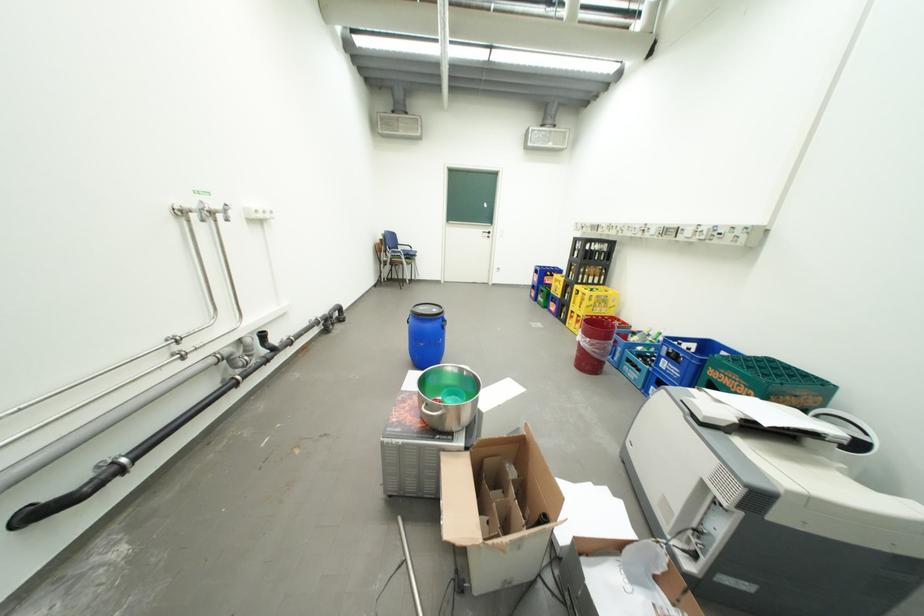
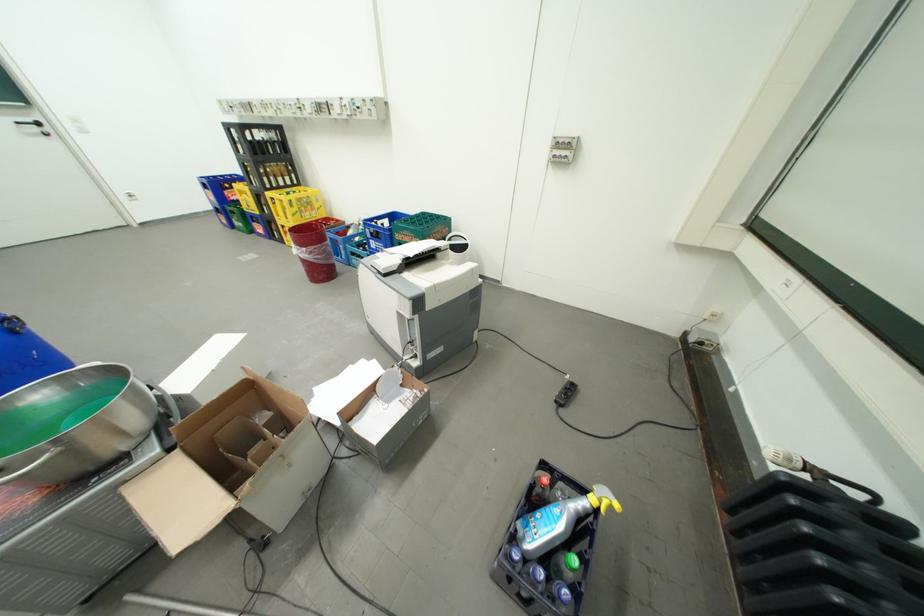
Locate, in the second image, the point that corresponds to the point at 674,361 in the first image.

(381, 241)